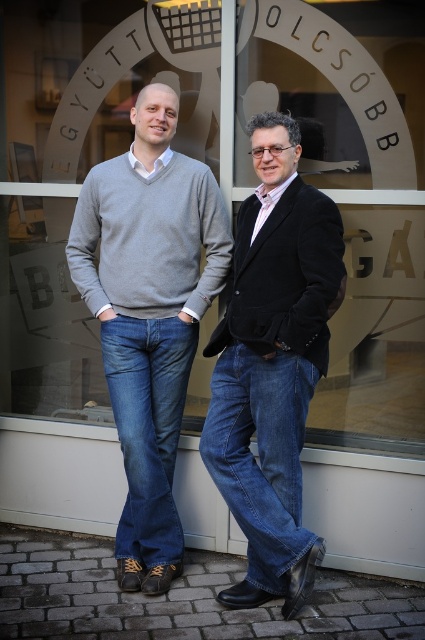
Where is `denim jeans at center`? The width and height of the screenshot is (425, 640). denim jeans at center is located at coordinates (272, 364).

Does denim jeans at center have a greater width compared to black velvet blazer at center?

Yes.

What do you see at coordinates (272, 364) in the screenshot? I see `denim jeans at center` at bounding box center [272, 364].

This screenshot has height=640, width=425. Identify the location of denim jeans at center. (272, 364).

Can you confirm if transparent glass shop window at center is wider than denim jeans at center?

Correct, the width of transparent glass shop window at center exceeds that of denim jeans at center.

Does point (309, 80) come farther from viewer compared to point (325, 314)?

Yes, it is behind point (325, 314).

Is point (68, 60) less distant than point (269, 358)?

That is False.

You are a GUI agent. You are given a task and a screenshot of the screen. Output one action in this format:
    pyautogui.click(x=<x>, y=<y>)
    Task: Click on the transparent glass shop window at center
    
    Given the screenshot: What is the action you would take?
    pyautogui.click(x=221, y=180)

Does transparent glass shop window at center have a greater height compared to black velvet blazer at center?

Yes, transparent glass shop window at center is taller than black velvet blazer at center.

What do you see at coordinates (221, 180) in the screenshot?
I see `transparent glass shop window at center` at bounding box center [221, 180].

This screenshot has height=640, width=425. What are the coordinates of `transparent glass shop window at center` in the screenshot? It's located at (221, 180).